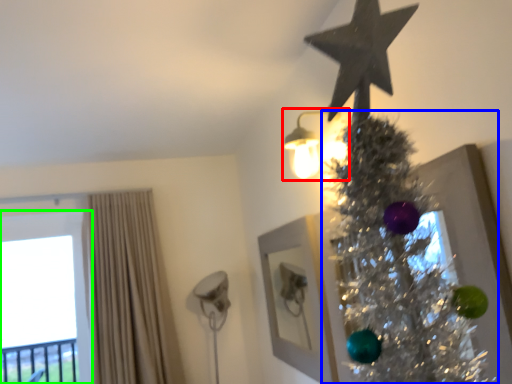
Question: Considering the real-world distances, which object is closest to light fixture (highlighted by a red box)? christmas tree (highlighted by a blue box) or window (highlighted by a green box).

Choices:
 (A) christmas tree
 (B) window

Answer: (A)